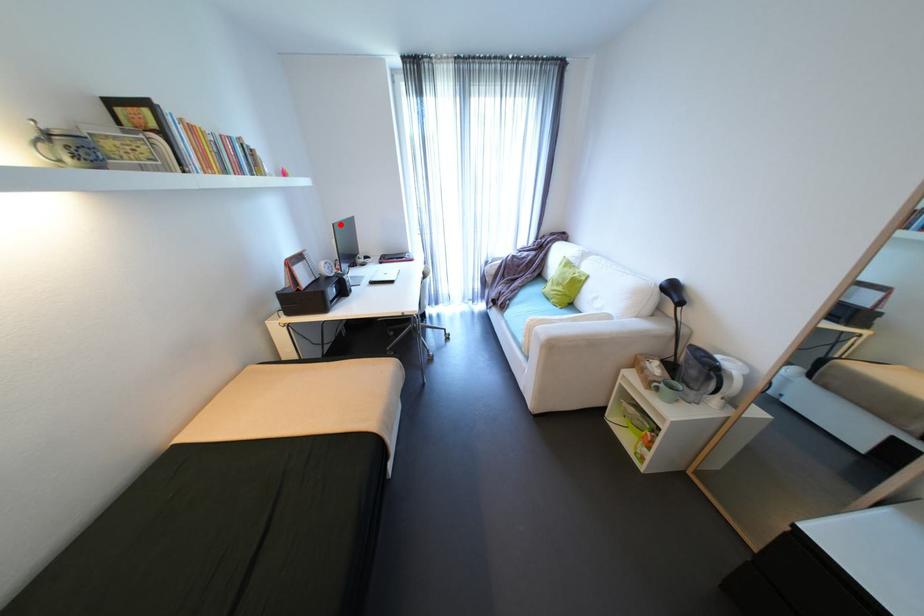
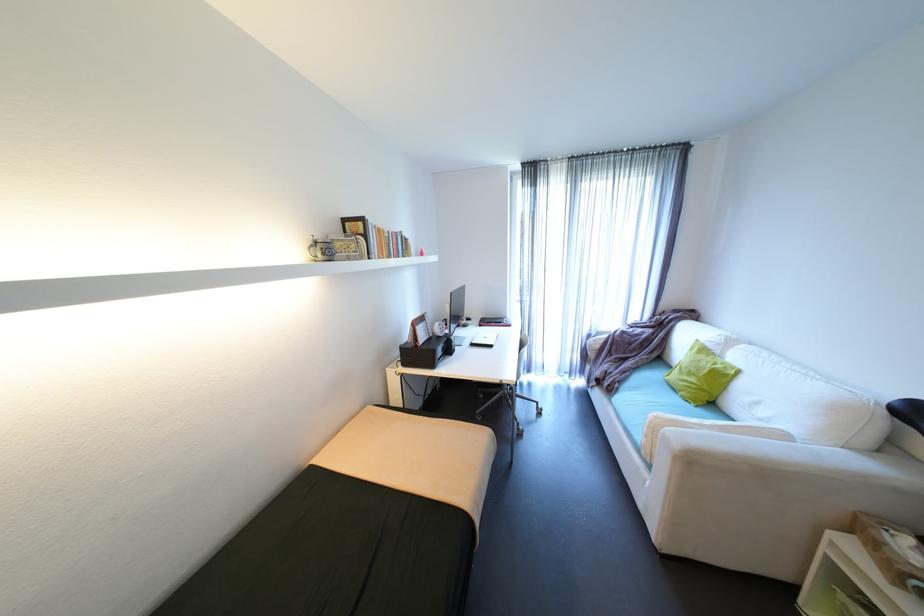
Question: A red point is marked in image1. In image2, is the corresponding 3D point closer to the camera or farther? Reply with the corresponding letter.

Choices:
 (A) The corresponding 3D point is closer.
 (B) The corresponding 3D point is farther.

Answer: (B)